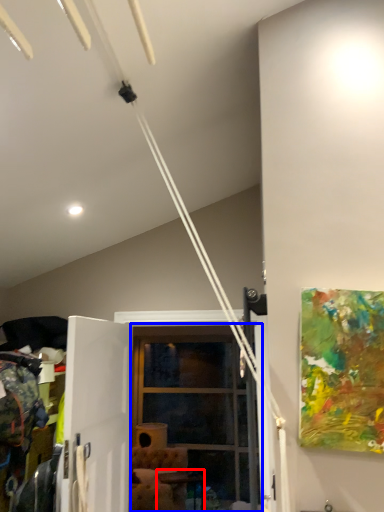
Question: Which object appears closest to the camera in this image, table (highlighted by a red box) or glass door (highlighted by a blue box)?

Choices:
 (A) table
 (B) glass door

Answer: (B)